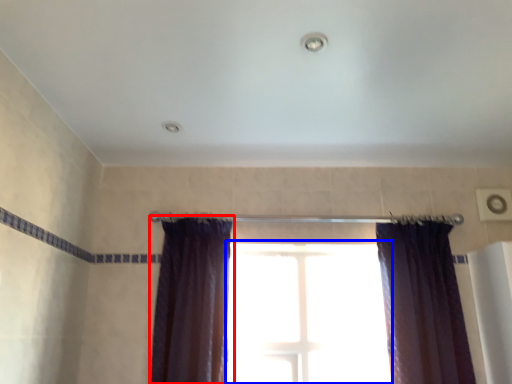
Question: Which of the following is the closest to the observer, curtain (highlighted by a red box) or window (highlighted by a blue box)?

Choices:
 (A) curtain
 (B) window

Answer: (A)